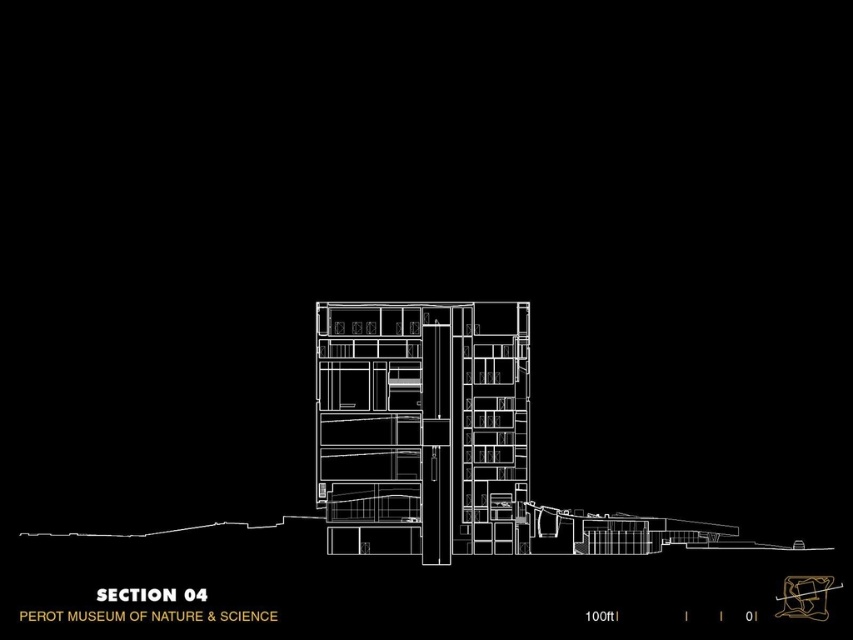
Question: Which point is closer to the camera taking this photo?

Choices:
 (A) click(x=432, y=435)
 (B) click(x=802, y=589)

Answer: (A)

Question: Is translucent glass building at center below matte gold sculpture at center?

Choices:
 (A) yes
 (B) no

Answer: (B)

Question: Does translucent glass building at center appear on the right side of matte gold sculpture at center?

Choices:
 (A) no
 (B) yes

Answer: (A)

Question: Which object is closer to the camera taking this photo?

Choices:
 (A) translucent glass building at center
 (B) matte gold sculpture at center

Answer: (A)

Question: Is translucent glass building at center thinner than matte gold sculpture at center?

Choices:
 (A) no
 (B) yes

Answer: (A)